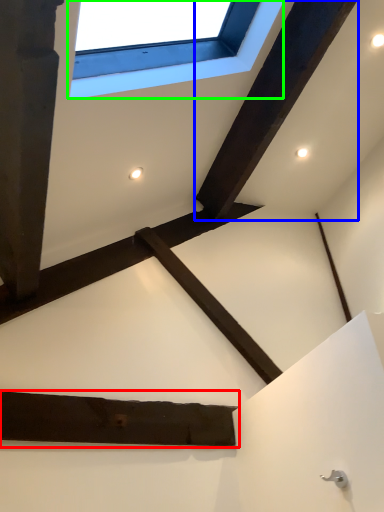
Question: Which is farther away from plank (highlighted by a red box)? plank (highlighted by a blue box) or window (highlighted by a green box)?

Choices:
 (A) plank
 (B) window

Answer: (A)